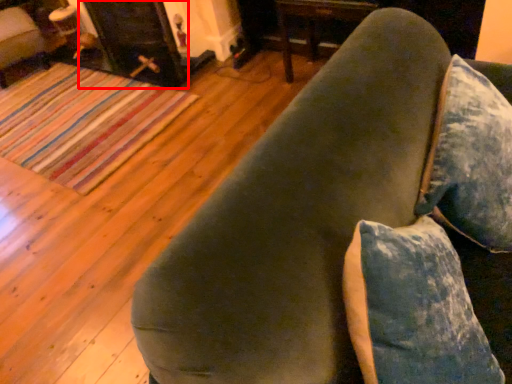
Question: From the image's perspective, where is fireplace (annotated by the red box) located relative to furniture?

Choices:
 (A) above
 (B) below

Answer: (A)